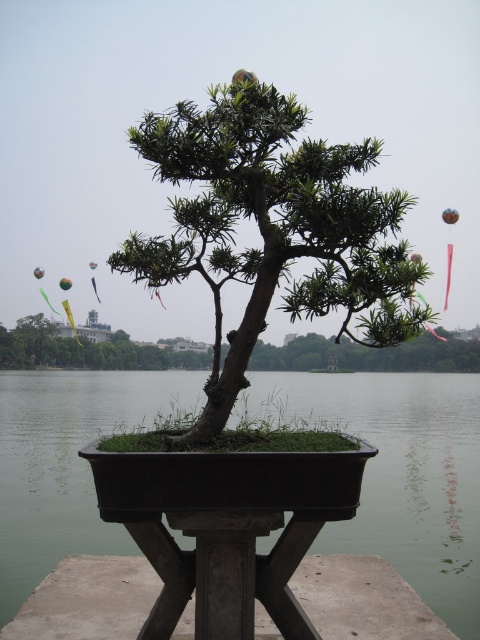
You are a gardener standing at the edge of the lakeside scene. You need to water the green matte bonsai at center. Which direction should you move to reach it from the green concrete water at center?

The green concrete water at center is to the right of the green matte bonsai at center, so you should move to the left to reach the green matte bonsai at center from the green concrete water at center.

You are standing at the edge of the lakeside scene and want to place a small decorative stone exactly at the center of the green concrete water at center. According to the coordinates provided, where should you place the stone?

The green concrete water at center is located at coordinates point (406, 476), so you should place the small decorative stone at that exact point to center it.

You are standing in the lakeside scene and want to place a small decorative stone on the closest object to you between the green concrete water at center and the green matte bonsai at center. Which object should you place it on?

You should place the small decorative stone on the green concrete water at center because it is closer to you than the green matte bonsai at center.